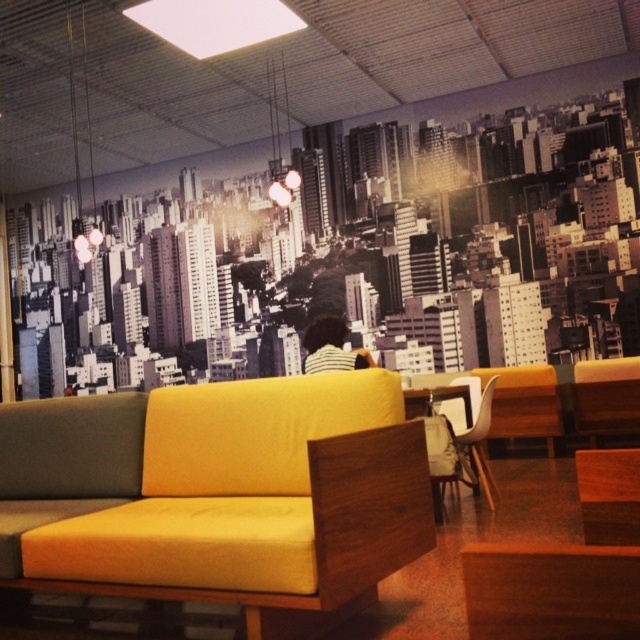
Question: Observing the image, what is the correct spatial positioning of yellow fabric couch at center in reference to white striped shirt at center?

Choices:
 (A) above
 (B) below

Answer: (B)

Question: Which object appears closest to the camera in this image?

Choices:
 (A) white plastic chair at lower right
 (B) yellow fabric couch at center

Answer: (B)

Question: Which is nearer to the yellow fabric couch at center?

Choices:
 (A) white striped shirt at center
 (B) white plastic chair at lower right

Answer: (A)

Question: Which object appears farthest from the camera in this image?

Choices:
 (A) white plastic chair at lower right
 (B) white striped shirt at center
 (C) yellow fabric couch at center

Answer: (A)

Question: Can you confirm if yellow fabric couch at center is bigger than white plastic chair at lower right?

Choices:
 (A) yes
 (B) no

Answer: (A)

Question: Considering the relative positions of yellow fabric couch at center and white plastic chair at lower right in the image provided, where is yellow fabric couch at center located with respect to white plastic chair at lower right?

Choices:
 (A) below
 (B) above

Answer: (B)